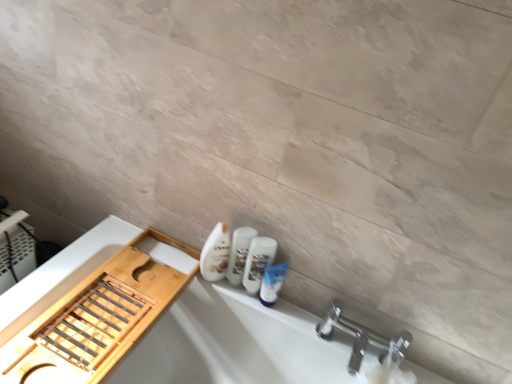
Question: Can you confirm if chrome metallic faucet at lower right is thinner than white matte bathtub at lower left?

Choices:
 (A) no
 (B) yes

Answer: (B)

Question: Is chrome metallic faucet at lower right next to white matte bathtub at lower left?

Choices:
 (A) no
 (B) yes

Answer: (A)

Question: Can you confirm if chrome metallic faucet at lower right is taller than white matte bathtub at lower left?

Choices:
 (A) no
 (B) yes

Answer: (A)

Question: Can you confirm if chrome metallic faucet at lower right is shorter than white matte bathtub at lower left?

Choices:
 (A) yes
 (B) no

Answer: (A)

Question: Is chrome metallic faucet at lower right bigger than white matte bathtub at lower left?

Choices:
 (A) no
 (B) yes

Answer: (A)

Question: Relative to chrome metallic faucet at lower right, is white matte bathtub at lower left in front or behind?

Choices:
 (A) behind
 (B) front

Answer: (B)

Question: From the image's perspective, relative to chrome metallic faucet at lower right, is white matte bathtub at lower left above or below?

Choices:
 (A) above
 (B) below

Answer: (B)

Question: Considering the relative positions of white matte bathtub at lower left and chrome metallic faucet at lower right in the image provided, is white matte bathtub at lower left to the left or to the right of chrome metallic faucet at lower right?

Choices:
 (A) right
 (B) left

Answer: (B)

Question: From their relative heights in the image, would you say white matte bathtub at lower left is taller or shorter than chrome metallic faucet at lower right?

Choices:
 (A) tall
 (B) short

Answer: (A)

Question: From the image's perspective, is white glossy mouthwash at lower right, which appears as the 2th mouthwash when viewed from the left, positioned above or below white matte bathtub at lower left?

Choices:
 (A) below
 (B) above

Answer: (B)

Question: Is white glossy mouthwash at lower right, which appears as the 2th mouthwash when viewed from the left, inside or outside of white matte bathtub at lower left?

Choices:
 (A) inside
 (B) outside

Answer: (B)

Question: Does point (253, 274) appear closer or farther from the camera than point (281, 370)?

Choices:
 (A) farther
 (B) closer

Answer: (B)

Question: Considering the positions of white glossy mouthwash at lower right, which appears as the 2th mouthwash when viewed from the left, and white matte bathtub at lower left in the image, is white glossy mouthwash at lower right, which appears as the 2th mouthwash when viewed from the left, wider or thinner than white matte bathtub at lower left?

Choices:
 (A) wide
 (B) thin

Answer: (B)

Question: From the image's perspective, relative to chrome metallic faucet at lower right, is white glossy bottle at center above or below?

Choices:
 (A) below
 (B) above

Answer: (B)

Question: From a real-world perspective, is white glossy bottle at center above or below chrome metallic faucet at lower right?

Choices:
 (A) above
 (B) below

Answer: (A)